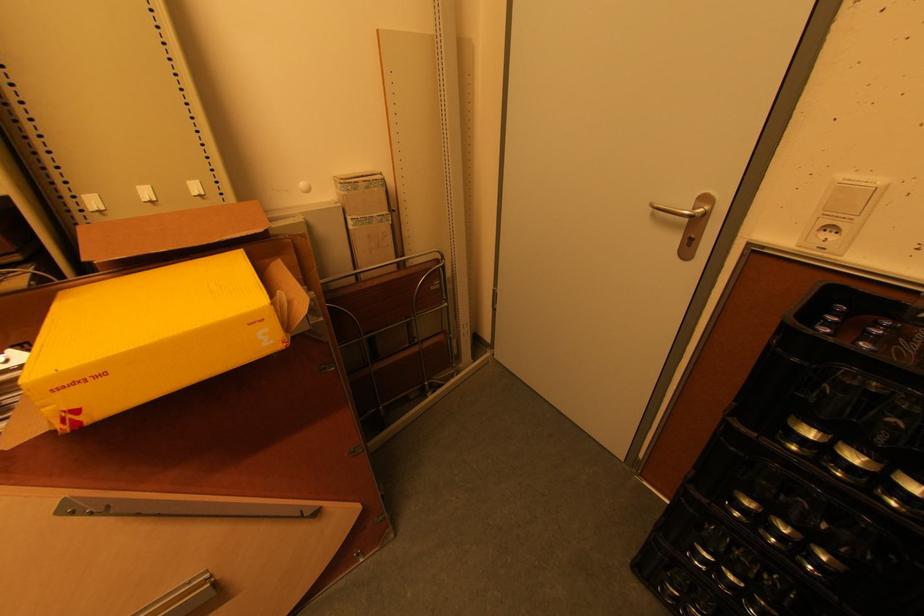
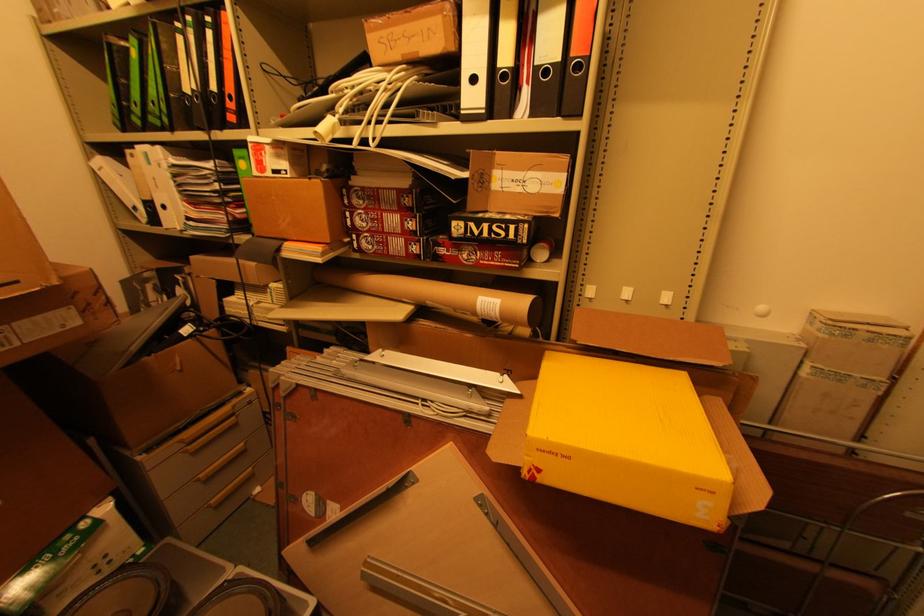
Question: Based on the continuous images, in which direction is the camera rotating? Reply with the corresponding letter.

Choices:
 (A) Left
 (B) Right
 (C) Up
 (D) Down

Answer: (A)